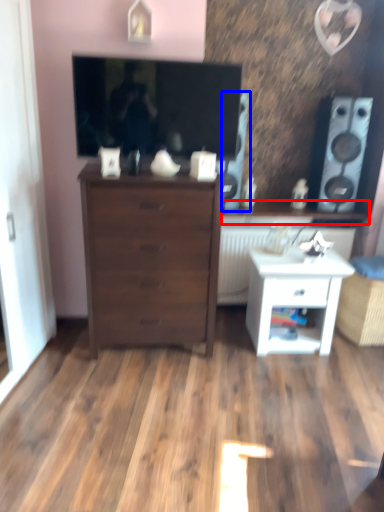
Question: Which object appears closest to the camera in this image, counter top (highlighted by a red box) or speaker (highlighted by a blue box)?

Choices:
 (A) counter top
 (B) speaker

Answer: (B)